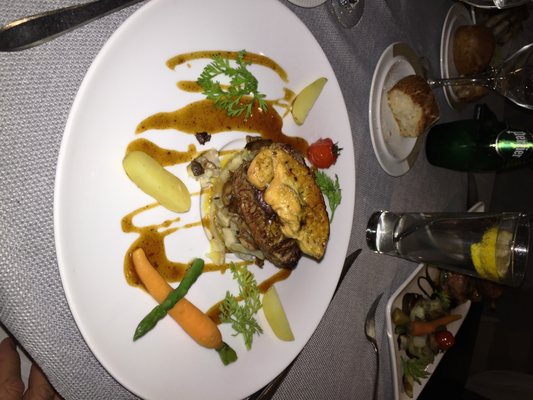
At what (x,y) coordinates should I click in order to perform the action: click on dessert plate. Please return your answer as a coordinate pair (x, y). Looking at the image, I should click on (384, 157).